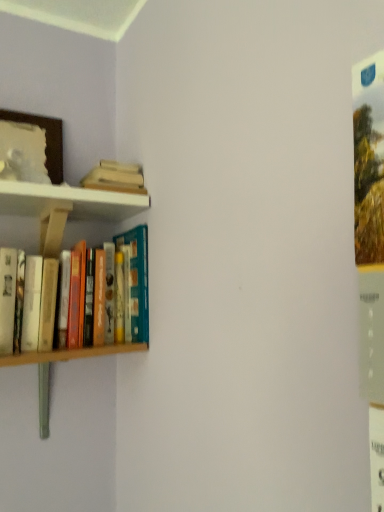
Question: Considering the relative positions of hardcover book at upper left, arranged as the 2th book when ordered from the bottom, and hardcover books at left, which appears as the 2th book when viewed from the top, in the image provided, is hardcover book at upper left, arranged as the 2th book when ordered from the bottom, to the right of hardcover books at left, which appears as the 2th book when viewed from the top, from the viewer's perspective?

Choices:
 (A) yes
 (B) no

Answer: (A)

Question: Does hardcover book at upper left, arranged as the 2th book when ordered from the bottom, have a lesser height compared to hardcover books at left, which appears as the 2th book when viewed from the top?

Choices:
 (A) yes
 (B) no

Answer: (A)

Question: Does hardcover book at upper left, arranged as the 2th book when ordered from the bottom, contain hardcover books at left, which appears as the 2th book when viewed from the top?

Choices:
 (A) no
 (B) yes

Answer: (A)

Question: Is hardcover book at upper left, the first book viewed from the top, facing towards hardcover books at left, which appears as the 2th book when viewed from the top?

Choices:
 (A) yes
 (B) no

Answer: (B)

Question: Does hardcover book at upper left, arranged as the 2th book when ordered from the bottom, lie in front of hardcover books at left, which appears as the 2th book when viewed from the top?

Choices:
 (A) no
 (B) yes

Answer: (A)

Question: From the image's perspective, is hardcover book at upper left, arranged as the 2th book when ordered from the bottom, over hardcover books at left, the first book when ordered from bottom to top?

Choices:
 (A) no
 (B) yes

Answer: (B)

Question: Is wooden picture frame at upper left at the right side of hardcover books at left, the first book when ordered from bottom to top?

Choices:
 (A) no
 (B) yes

Answer: (A)

Question: Is wooden picture frame at upper left further to camera compared to hardcover books at left, the first book when ordered from bottom to top?

Choices:
 (A) yes
 (B) no

Answer: (A)

Question: Is wooden picture frame at upper left far away from hardcover books at left, the first book when ordered from bottom to top?

Choices:
 (A) yes
 (B) no

Answer: (B)

Question: Is wooden picture frame at upper left facing away from hardcover books at left, the first book when ordered from bottom to top?

Choices:
 (A) yes
 (B) no

Answer: (B)

Question: Is wooden picture frame at upper left thinner than hardcover books at left, the first book when ordered from bottom to top?

Choices:
 (A) no
 (B) yes

Answer: (B)

Question: Considering the relative positions of wooden picture frame at upper left and hardcover books at left, which appears as the 2th book when viewed from the top, in the image provided, is wooden picture frame at upper left to the left of hardcover books at left, which appears as the 2th book when viewed from the top, from the viewer's perspective?

Choices:
 (A) yes
 (B) no

Answer: (A)

Question: Does hardcover books at left, which appears as the 2th book when viewed from the top, have a lesser width compared to hardcover book at upper left, the first book viewed from the top?

Choices:
 (A) no
 (B) yes

Answer: (A)